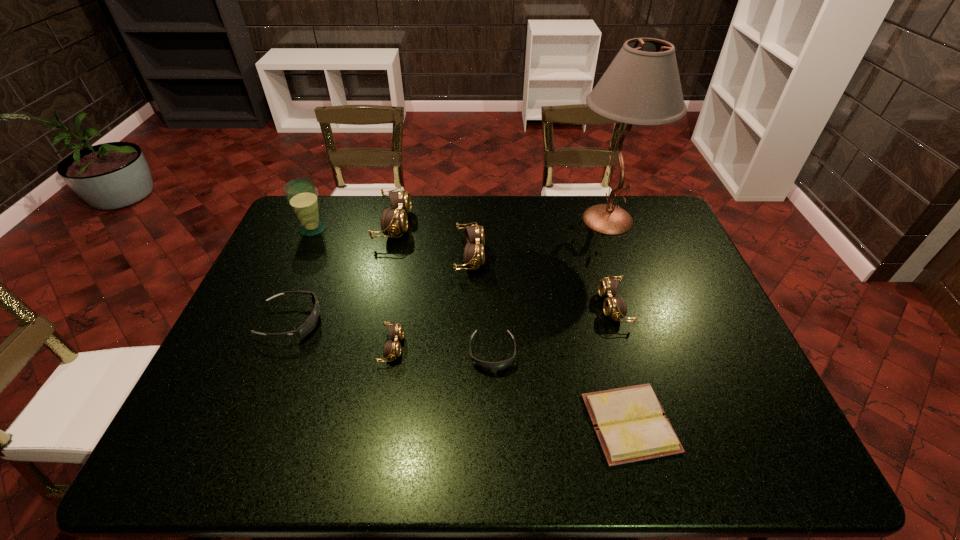
Find the location of a particular element. The width and height of the screenshot is (960, 540). object that stands as the seventh closest to the eighth tallest object is located at coordinates (642, 86).

Identify the location of object that is the closest one to the third tallest object. pos(474,255).

Choose which goggles is the second nearest neighbor to the smallest brown goggles. Please provide its 2D coordinates. Your answer should be formatted as a tuple, i.e. [(x, y)], where the tuple contains the x and y coordinates of a point satisfying the conditions above.

[(310, 323)]

Select which goggles is the fourth closest to the tallest goggles. Please provide its 2D coordinates. Your answer should be formatted as a tuple, i.e. [(x, y)], where the tuple contains the x and y coordinates of a point satisfying the conditions above.

[(484, 365)]

Choose which brown goggles is the nearest neighbor to the third biggest brown goggles. Please provide its 2D coordinates. Your answer should be formatted as a tuple, i.e. [(x, y)], where the tuple contains the x and y coordinates of a point satisfying the conditions above.

[(474, 255)]

Select which brown goggles appears as the second closest to the nearest object. Please provide its 2D coordinates. Your answer should be formatted as a tuple, i.e. [(x, y)], where the tuple contains the x and y coordinates of a point satisfying the conditions above.

[(474, 255)]

Where is `free point that satisfies the following two spatial constraints: 1. on the back side of the shortest object; 2. through the lenses of the fifth shortest goggles`? free point that satisfies the following two spatial constraints: 1. on the back side of the shortest object; 2. through the lenses of the fifth shortest goggles is located at coordinates (587, 255).

Where is `free spot that satisfies the following two spatial constraints: 1. through the lenses of the shortest object; 2. on the left side of the tallest goggles`? free spot that satisfies the following two spatial constraints: 1. through the lenses of the shortest object; 2. on the left side of the tallest goggles is located at coordinates (348, 423).

The width and height of the screenshot is (960, 540). Find the location of `free space that satisfies the following two spatial constraints: 1. through the lenses of the fifth tallest object; 2. on the lenses of the shortest goggles`. free space that satisfies the following two spatial constraints: 1. through the lenses of the fifth tallest object; 2. on the lenses of the shortest goggles is located at coordinates (627, 353).

Where is `vacant point that satisfies the following two spatial constraints: 1. through the lenses of the third tallest object; 2. on the back side of the shortest object`? vacant point that satisfies the following two spatial constraints: 1. through the lenses of the third tallest object; 2. on the back side of the shortest object is located at coordinates (348, 423).